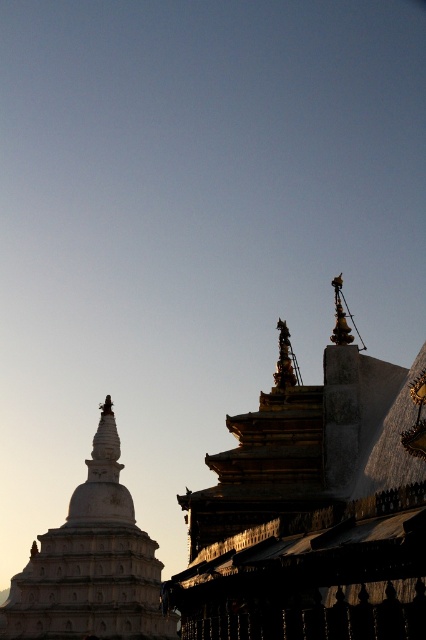
Is point (213, 460) behind point (66, 593)?

No, it is in front of (66, 593).

Who is more distant from viewer, (388, 388) or (132, 529)?

Positioned behind is point (132, 529).

Locate an element on the screen. The height and width of the screenshot is (640, 426). gold/gilded stone temple at upper center is located at coordinates (313, 508).